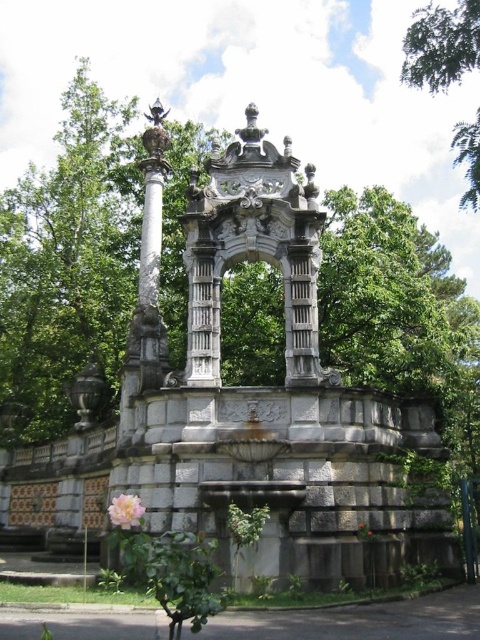
Does gray stone fountain at center have a larger size compared to pink matte flower at lower left?

Yes, gray stone fountain at center is bigger than pink matte flower at lower left.

Between gray stone fountain at center and pink matte flower at lower left, which one appears on the left side from the viewer's perspective?

pink matte flower at lower left is more to the left.

The image size is (480, 640). What do you see at coordinates (266, 396) in the screenshot? I see `gray stone fountain at center` at bounding box center [266, 396].

This screenshot has height=640, width=480. Find the location of `gray stone fountain at center`. gray stone fountain at center is located at coordinates (266, 396).

Is green leafy tree at upper right further to camera compared to pink matte flower at lower left?

That is True.

Measure the distance between green leafy tree at upper right and camera.

A distance of 66.93 meters exists between green leafy tree at upper right and camera.

Locate an element on the screen. The width and height of the screenshot is (480, 640). green leafy tree at upper right is located at coordinates coord(442,45).

Does gray stone fountain at center have a greater height compared to green leafy tree at upper right?

In fact, gray stone fountain at center may be shorter than green leafy tree at upper right.

Does point (405, 554) lie in front of point (424, 20)?

Yes, it is.

In order to click on gray stone fountain at center in this screenshot , I will do `click(266, 396)`.